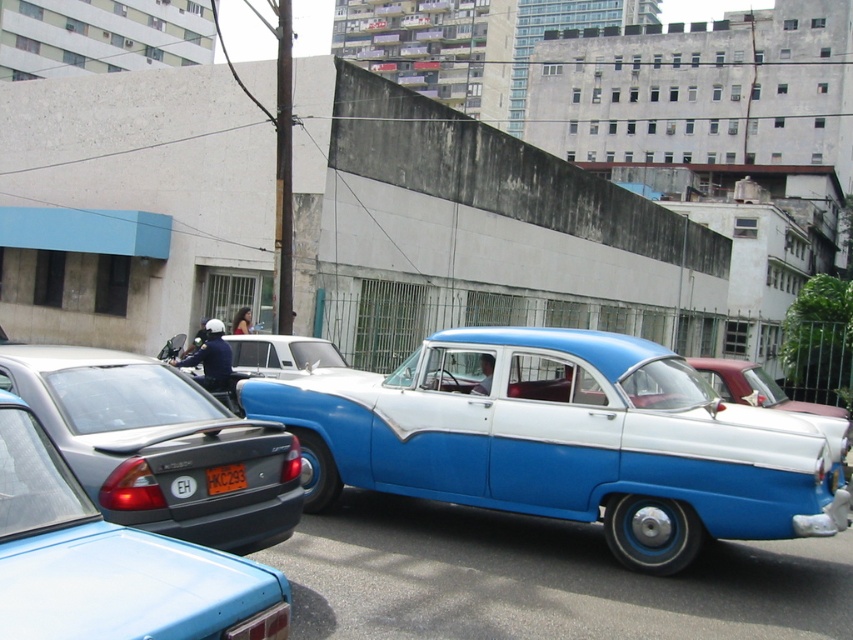
Is point (155, 412) more distant than point (225, 472)?

Yes.

Is point (117, 449) farther from viewer compared to point (227, 477)?

That is False.

I want to click on matte black sedan at lower left, so click(158, 445).

Is blue metallic car at center to the right of yellow plastic license plate at center from the viewer's perspective?

Indeed, blue metallic car at center is positioned on the right side of yellow plastic license plate at center.

Between blue metallic car at center and yellow plastic license plate at center, which one has less height?

yellow plastic license plate at center is shorter.

Does point (773, 528) come farther from viewer compared to point (210, 474)?

Yes, point (773, 528) is behind point (210, 474).

Locate an element on the screen. This screenshot has width=853, height=640. blue metallic car at center is located at coordinates (566, 440).

Who is lower down, blue metallic car at center or matte black sedan at lower left?

Positioned lower is blue metallic car at center.

Which is more to the left, blue metallic car at center or matte black sedan at lower left?

From the viewer's perspective, matte black sedan at lower left appears more on the left side.

Locate an element on the screen. The width and height of the screenshot is (853, 640). blue metallic car at center is located at coordinates (566, 440).